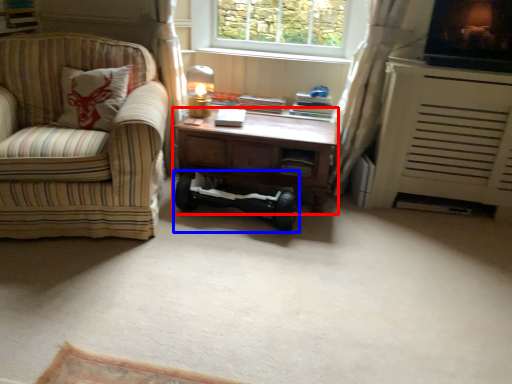
Question: Which object appears closest to the camera in this image, desk (highlighted by a red box) or mobility scooter (highlighted by a blue box)?

Choices:
 (A) desk
 (B) mobility scooter

Answer: (B)